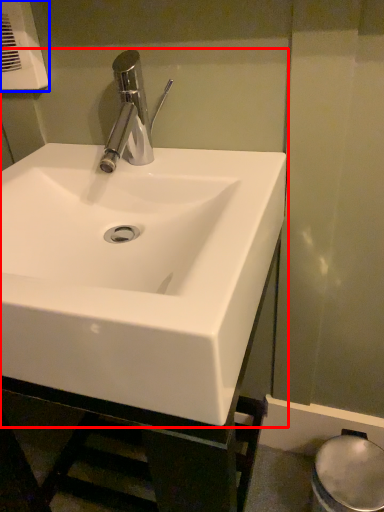
Question: Which point is closer to the camera, sink (highlighted by a red box) or hand dryer (highlighted by a blue box)?

Choices:
 (A) sink
 (B) hand dryer

Answer: (A)